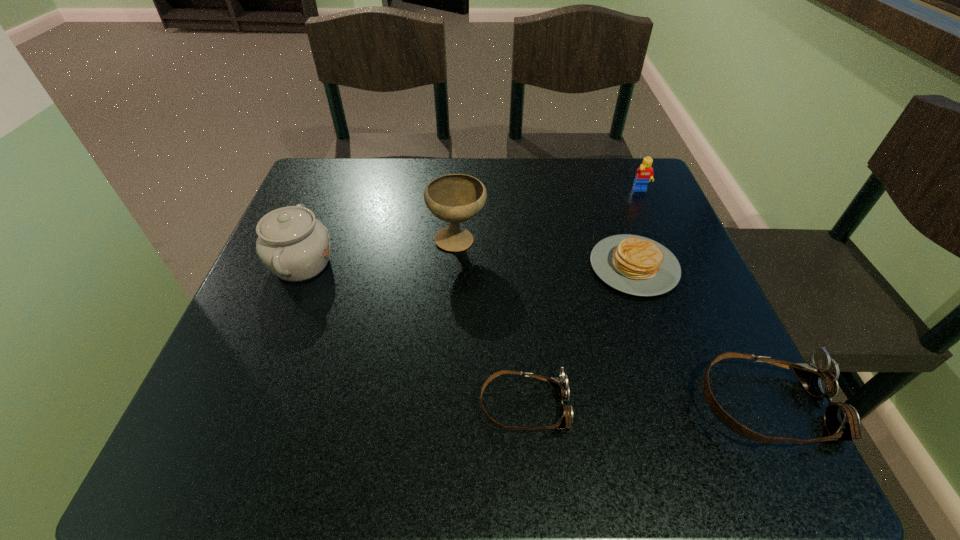
With all goggless evenly spaced, where should an extra goggles be placed on the left to continue the pattern? Please point out a vacant space. Please provide its 2D coordinates. Your answer should be formatted as a tuple, i.e. [(x, y)], where the tuple contains the x and y coordinates of a point satisfying the conditions above.

[(283, 407)]